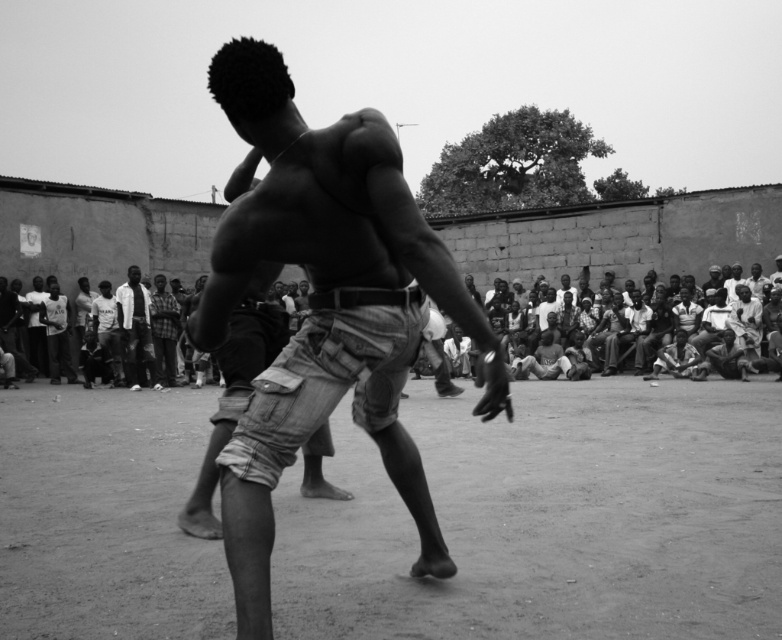
Question: Does dirt field at center have a larger size compared to checkered fabric shirt at center?

Choices:
 (A) no
 (B) yes

Answer: (B)

Question: From the image, what is the correct spatial relationship of light gray cotton shirt at center in relation to checkered fabric shirt at center?

Choices:
 (A) below
 (B) above

Answer: (B)

Question: Which object is positioned closest to the light gray cotton shirt at center?

Choices:
 (A) checkered fabric shirt at center
 (B) dirt field at center
 (C) denim shorts at center

Answer: (A)

Question: Is dark clothing crowd at center to the left of checkered fabric shirt at center from the viewer's perspective?

Choices:
 (A) yes
 (B) no

Answer: (B)

Question: Which point is closer to the camera taking this photo?

Choices:
 (A) (436, 552)
 (B) (137, 284)
 (C) (133, 326)
 (D) (511, 481)

Answer: (A)

Question: Considering the real-world distances, which object is farthest from the dirt field at center?

Choices:
 (A) dark clothing crowd at center
 (B) checkered fabric shirt at center

Answer: (B)